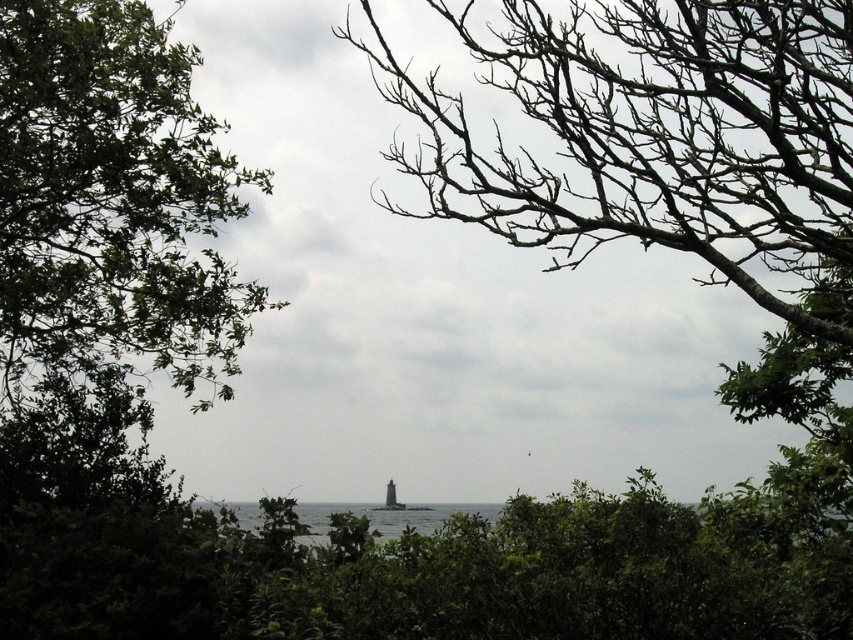
You are a bird flying over the coastal scene. You want to land on the brown bark tree at center. Based on its 2D coordinates, where would you aim to land?

The brown bark tree at center is located at the 2D coordinates point (656, 136), so you should aim for that specific point to land on it.

You are standing in the coastal scene and want to place a small flag at each of the two points marked in the image. The first point is at coordinates point (x=583, y=10) and the second is at point (x=181, y=224). Which flag will be closer to you when you look at the image?

The flag placed at point (x=583, y=10) will be closer to you because it is closer to the viewer than point (x=181, y=224) according to the description.